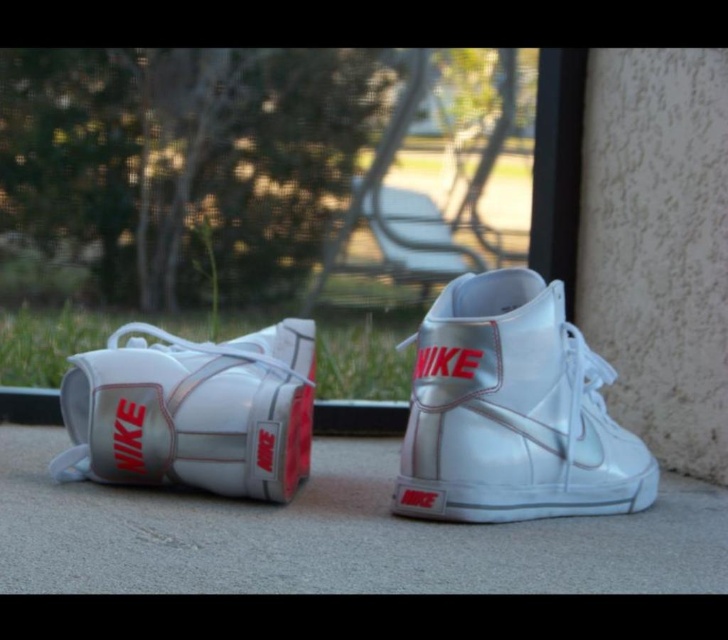
Can you confirm if metallic white sneaker at center is thinner than metallic white sneaker at left?

No, metallic white sneaker at center is not thinner than metallic white sneaker at left.

From the picture: Can you confirm if metallic white sneaker at center is positioned below metallic white sneaker at left?

→ Incorrect, metallic white sneaker at center is not positioned below metallic white sneaker at left.

Locate an element on the screen. This screenshot has width=728, height=640. metallic white sneaker at center is located at coordinates (513, 412).

What are the coordinates of `metallic white sneaker at center` in the screenshot? It's located at tap(513, 412).